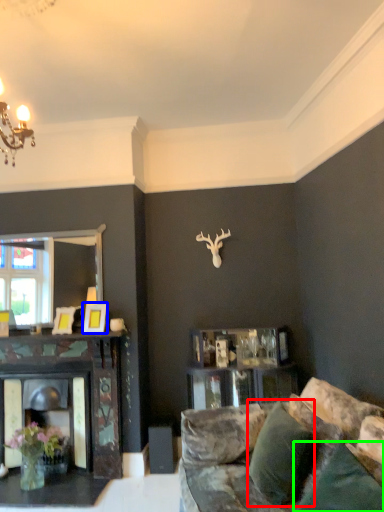
Question: Considering the real-world distances, which object is closest to pillow (highlighted by a red box)? picture frame (highlighted by a blue box) or pillow (highlighted by a green box).

Choices:
 (A) picture frame
 (B) pillow

Answer: (B)